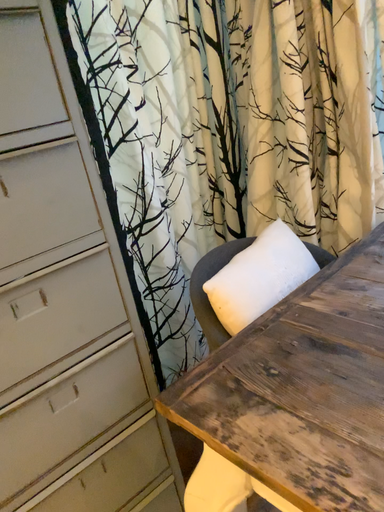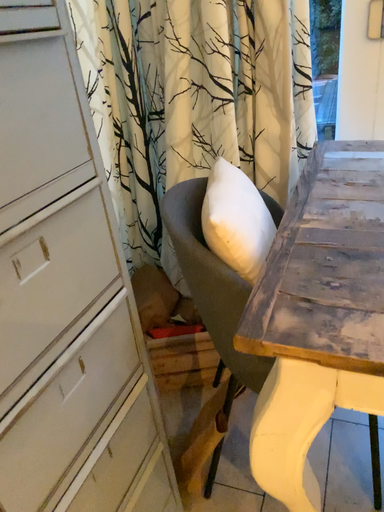
Question: How did the camera likely rotate when shooting the video?

Choices:
 (A) rotated left
 (B) rotated right

Answer: (B)